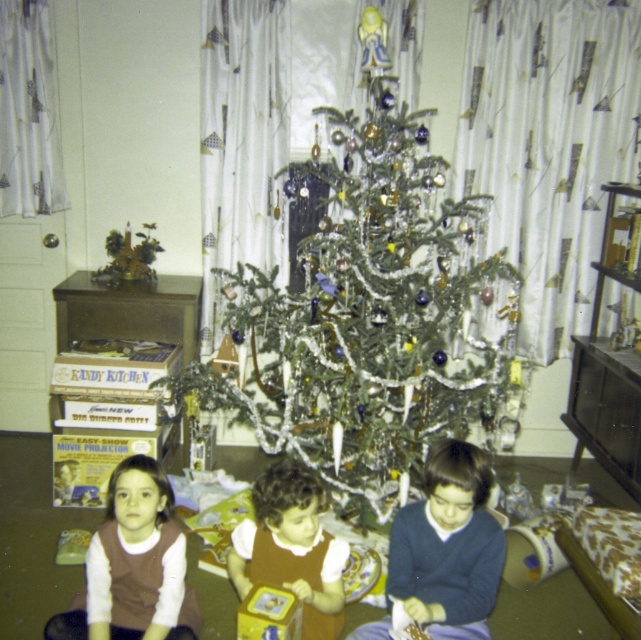
You are a guest at a holiday party and want to take a photo with the green shiny tree at center and the brown velvet dress at center. Since you want to ensure both are fully visible in the frame, which object should you position closer to the camera to avoid cropping?

The brown velvet dress at center should be positioned closer to the camera because it is shorter than the green shiny tree at center, ensuring both are fully visible without cropping.

You are a parent trying to choose between two outfits for your child to wear to a holiday party. The outfits available are the dark blue sweater at center and the brown velvet dress at center. Based on their sizes, which one might be more suitable for a child who prefers a snugger fit?

The brown velvet dress at center has a smaller height than the dark blue sweater at center, making it potentially more suitable for a child who prefers a snugger fit since it is shorter in height.